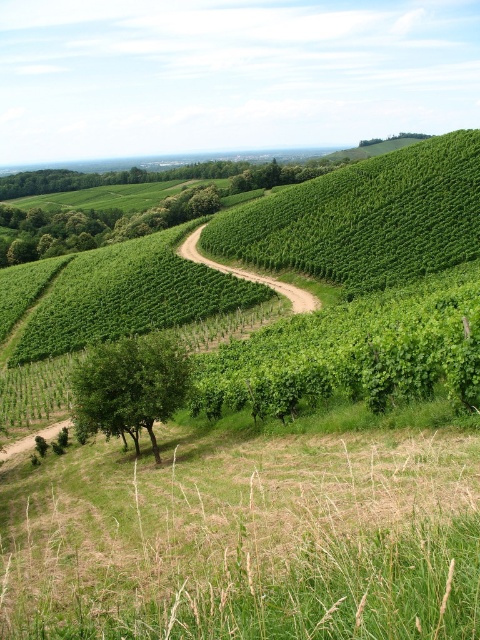
Question: Which point is closer to the camera taking this photo?

Choices:
 (A) tap(288, 296)
 (B) tap(107, 429)

Answer: (B)

Question: Is green leafy tree at lower left below dirt/path at center?

Choices:
 (A) no
 (B) yes

Answer: (B)

Question: Does green leafy tree at lower left have a greater width compared to dirt/path at center?

Choices:
 (A) yes
 (B) no

Answer: (B)

Question: Which object is closer to the camera taking this photo?

Choices:
 (A) green leafy tree at lower left
 (B) dirt/path at center

Answer: (A)

Question: Is the position of green leafy tree at lower left more distant than that of dirt/path at center?

Choices:
 (A) yes
 (B) no

Answer: (B)